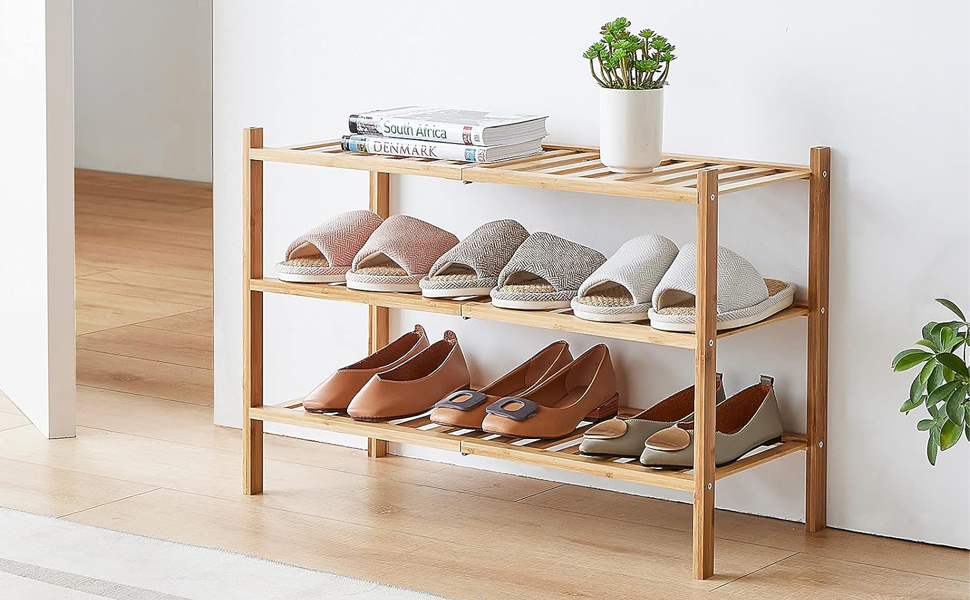
At what (x,y) coordinates should I click in order to perform the action: click on shelf legs. Please return your answer as a coordinate pair (x, y). The image size is (970, 600). Looking at the image, I should click on (700, 405), (824, 355), (385, 180), (251, 217).